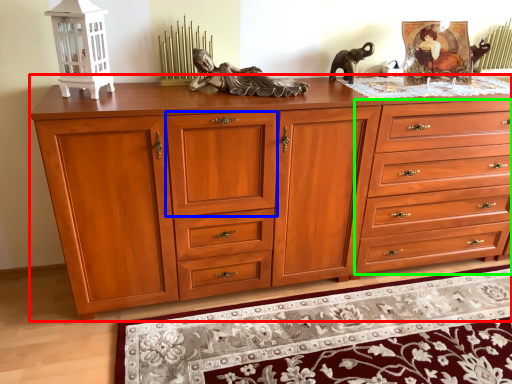
Question: Considering the real-world distances, which object is farthest from chest of drawers (highlighted by a red box)? drawer (highlighted by a blue box) or drawer (highlighted by a green box)?

Choices:
 (A) drawer
 (B) drawer

Answer: (B)